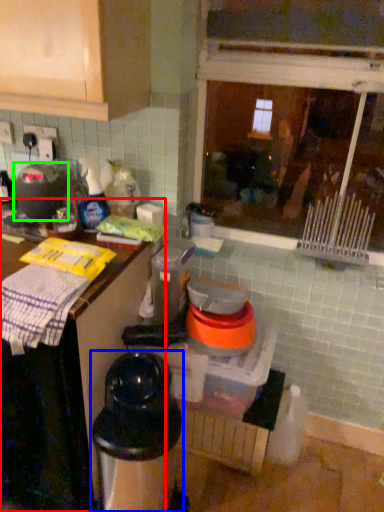
Question: Based on their relative distances, which object is farther from countertop (highlighted by a red box)? Choose from appliance (highlighted by a blue box) and appliance (highlighted by a green box).

Choices:
 (A) appliance
 (B) appliance

Answer: (B)